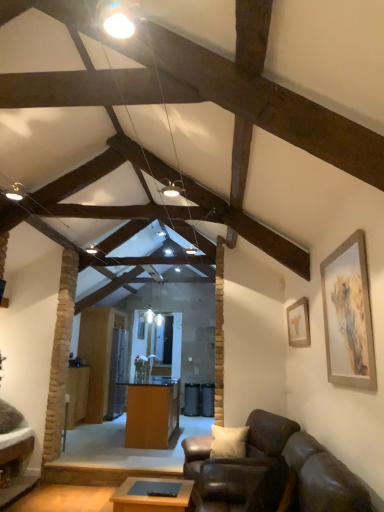
Question: Does point coord(299,334) appear closer or farther from the camera than point coord(140,408)?

Choices:
 (A) closer
 (B) farther

Answer: (A)

Question: Relative to orange wood desk at center, is matte gold picture frame at upper right, the second picture frame when ordered from left to right, in front or behind?

Choices:
 (A) behind
 (B) front

Answer: (B)

Question: Which object is the farthest from the leather couch at lower right?

Choices:
 (A) matte gold picture frame at upper right, which is counted as the second picture frame, starting from the front
 (B) wooden table at center, marked as the second table in a front-to-back arrangement
 (C) silver metallic picture frame at right, placed as the 2th picture frame when sorted from right to left
 (D) wooden table at center, placed as the 2th table when sorted from left to right
 (E) orange wood desk at center

Answer: (B)

Question: Which of these objects is positioned farthest from the orange wood desk at center?

Choices:
 (A) silver metallic picture frame at right, acting as the 2th picture frame starting from the back
 (B) wooden table at center, placed as the 2th table when sorted from left to right
 (C) leather couch at lower right
 (D) matte gold picture frame at upper right, the first picture frame viewed from the back
 (E) wooden table at center, which is counted as the 1th table, starting from the back

Answer: (A)